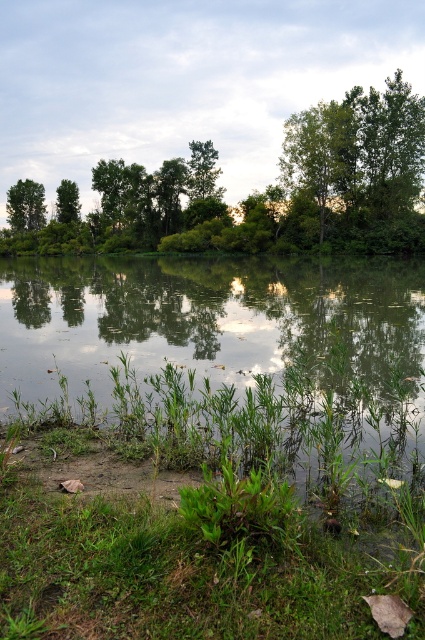
Question: Which is farther from the green leafy tree at upper left?

Choices:
 (A) green leafy trees at upper center
 (B) green matte tree at upper left

Answer: (A)

Question: Can you confirm if green leafy trees at upper center is positioned above green leafy tree at upper left?

Choices:
 (A) no
 (B) yes

Answer: (A)

Question: Which object is the closest to the green leafy tree at upper left?

Choices:
 (A) green matte tree at upper left
 (B) green leafy trees at upper center

Answer: (A)

Question: Which of these objects is positioned closest to the green leafy tree at upper left?

Choices:
 (A) green leafy trees at upper center
 (B) green matte tree at upper left

Answer: (B)

Question: Does green leafy tree at upper left appear on the left side of green matte tree at upper left?

Choices:
 (A) no
 (B) yes

Answer: (B)

Question: Is green leafy trees at upper center behind green matte tree at upper left?

Choices:
 (A) yes
 (B) no

Answer: (B)